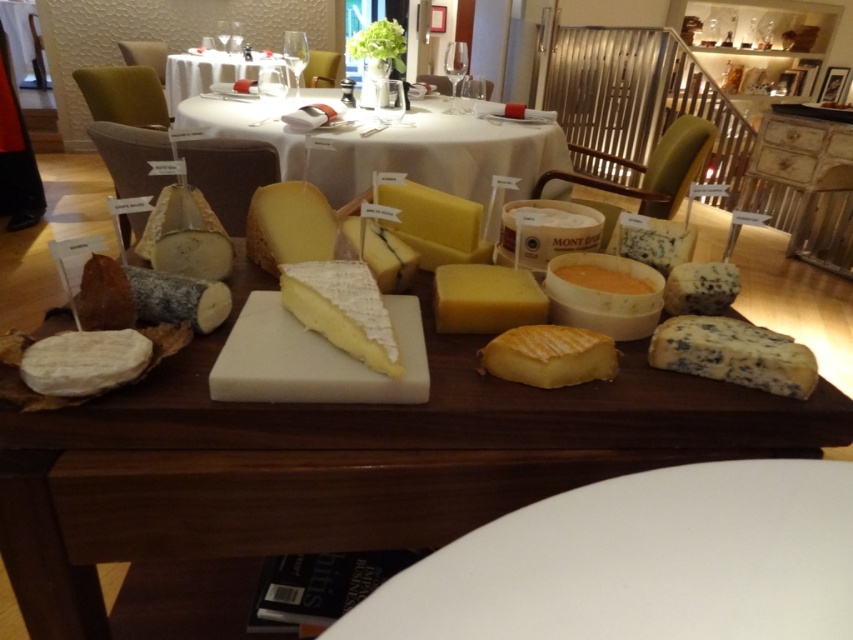
You are a guest at a dinner party and want to choose between the blue crumbly cheese at right and the yellow wax cheese at center. Which cheese is wider?

The blue crumbly cheese at right is wider than the yellow wax cheese at center.

You are a guest at a dinner party and want to taste the blue crumbly cheese at right and the yellow wax cheese at center. Which cheese should you reach for first if you want to avoid moving the other?

The blue crumbly cheese at right is positioned under the yellow wax cheese at center, so you should reach for the yellow wax cheese at center first to avoid moving the blue crumbly cheese at right.